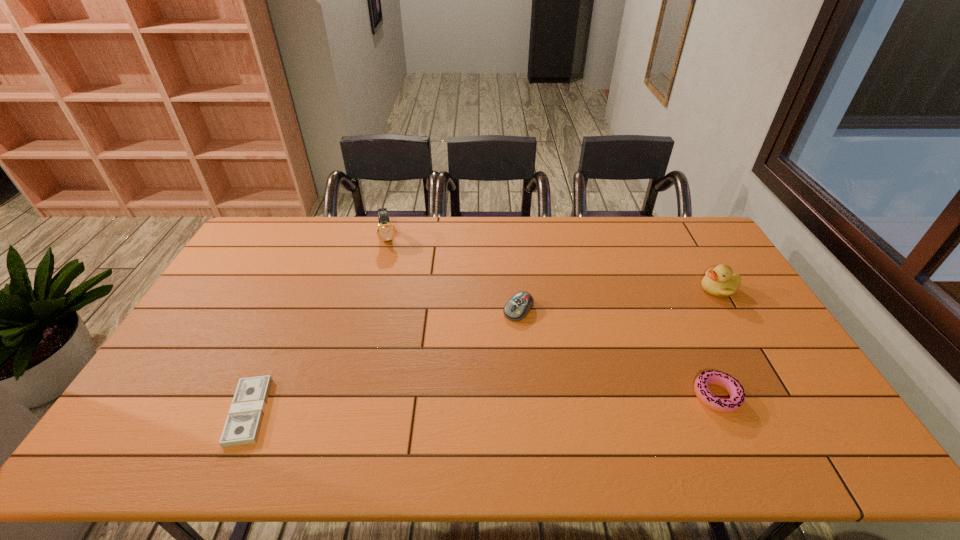
The width and height of the screenshot is (960, 540). Identify the location of empty location between the computer mouse and the watch. (454, 274).

This screenshot has height=540, width=960. In order to click on free space between the duckling and the dollar in this screenshot , I will do `click(484, 350)`.

In order to click on free space between the fourth object from right to left and the third object from left to right in this screenshot , I will do `click(454, 274)`.

The width and height of the screenshot is (960, 540). Identify the location of free space between the leftmost object and the second object from right to left. (483, 404).

This screenshot has height=540, width=960. I want to click on free space between the dollar and the duckling, so click(484, 350).

This screenshot has height=540, width=960. I want to click on empty space between the second object from left to right and the shortest object, so click(320, 325).

At what (x,y) coordinates should I click in order to perform the action: click on vacant area that lies between the second object from right to left and the leftmost object. Please return your answer as a coordinate pair (x, y). This screenshot has height=540, width=960. Looking at the image, I should click on (483, 404).

At what (x,y) coordinates should I click in order to perform the action: click on empty space that is in between the farthest object and the dollar. Please return your answer as a coordinate pair (x, y). Image resolution: width=960 pixels, height=540 pixels. Looking at the image, I should click on (320, 325).

Where is `blank region between the fourth shortest object and the leftmost object`? blank region between the fourth shortest object and the leftmost object is located at coordinates (484, 350).

Find the location of `vacant space in between the tallest object and the fourth shortest object`. vacant space in between the tallest object and the fourth shortest object is located at coordinates (554, 264).